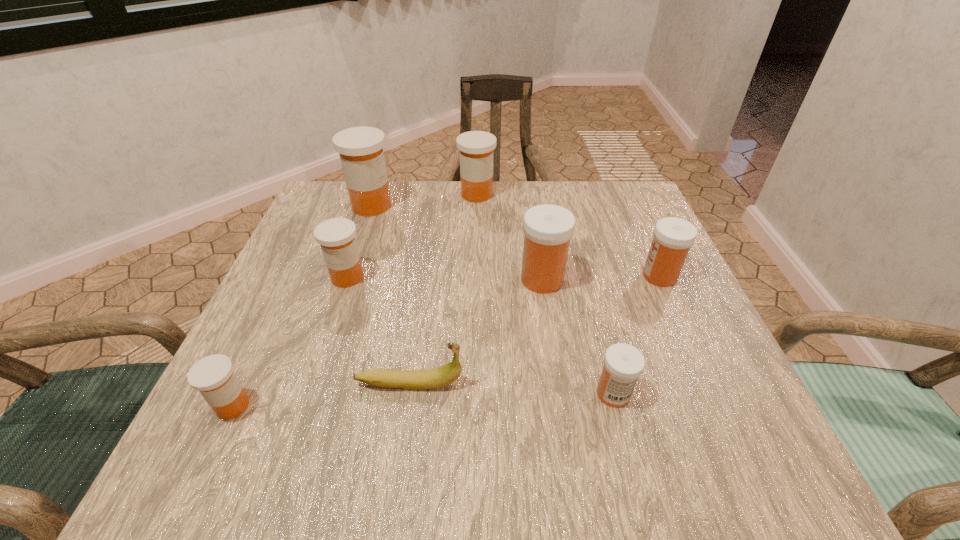
Identify which object is the seventh closest to the third biggest orange medicine. Please provide its 2D coordinates. Your answer should be formatted as a tuple, i.e. [(x, y)], where the tuple contains the x and y coordinates of a point satisfying the conditions above.

[(673, 237)]

Locate which object ranks sixth in proximity to the leftmost white medicine. Please provide its 2D coordinates. Your answer should be formatted as a tuple, i.e. [(x, y)], where the tuple contains the x and y coordinates of a point satisfying the conditions above.

[(361, 153)]

Identify which medicine is the second closest to the tallest object. Please provide its 2D coordinates. Your answer should be formatted as a tuple, i.e. [(x, y)], where the tuple contains the x and y coordinates of a point satisfying the conditions above.

[(336, 236)]

Locate an element on the screen. The image size is (960, 540). medicine that is the fifth closest to the rightmost object is located at coordinates (361, 153).

Point out which orange medicine is positioned as the nearest to the second smallest orange medicine. Please provide its 2D coordinates. Your answer should be formatted as a tuple, i.e. [(x, y)], where the tuple contains the x and y coordinates of a point satisfying the conditions above.

[(361, 153)]

Locate which orange medicine ranks in proximity to the fourth medicine from right to left. Please provide its 2D coordinates. Your answer should be formatted as a tuple, i.e. [(x, y)], where the tuple contains the x and y coordinates of a point satisfying the conditions above.

[(361, 153)]

Select which white medicine is the second closest to the sixth medicine from left to right. Please provide its 2D coordinates. Your answer should be formatted as a tuple, i.e. [(x, y)], where the tuple contains the x and y coordinates of a point satisfying the conditions above.

[(673, 237)]

Where is `the third closest white medicine relative to the banana`? the third closest white medicine relative to the banana is located at coordinates (673, 237).

Locate an element on the screen. This screenshot has width=960, height=540. free location that satisfies the following two spatial constraints: 1. on the label of the rightmost orange medicine; 2. on the right side of the smallest white medicine is located at coordinates (474, 394).

This screenshot has width=960, height=540. I want to click on vacant space that satisfies the following two spatial constraints: 1. on the label of the tallest object; 2. on the label of the third farthest orange medicine, so click(348, 277).